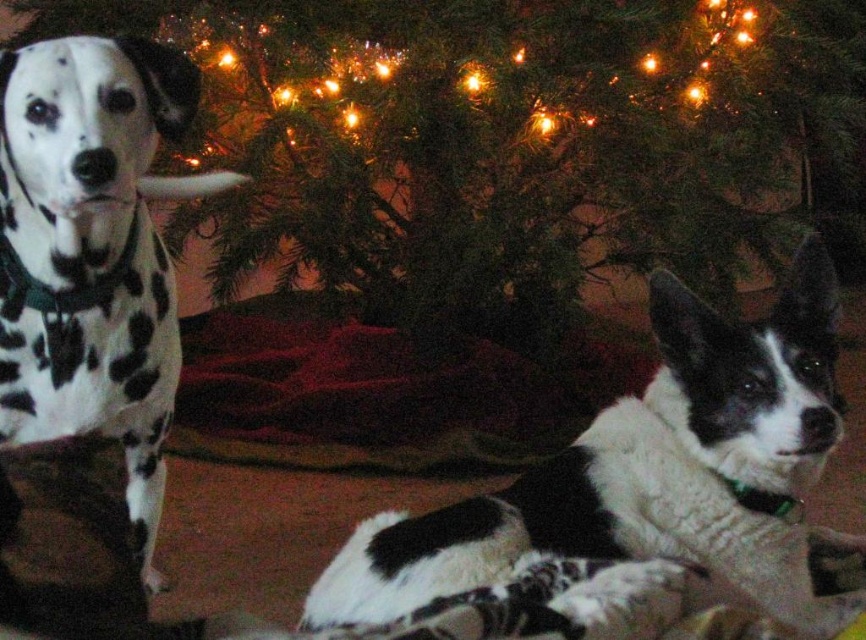
Question: Is green textured christmas tree at center to the left of black and white fur at lower right from the viewer's perspective?

Choices:
 (A) no
 (B) yes

Answer: (A)

Question: Based on their relative distances, which object is nearer to the spotted fur dog at left?

Choices:
 (A) black and white fur at lower right
 (B) green textured christmas tree at center

Answer: (A)

Question: Does green textured christmas tree at center appear on the right side of spotted fur dog at left?

Choices:
 (A) no
 (B) yes

Answer: (B)

Question: Is green textured christmas tree at center above black and white fur at lower right?

Choices:
 (A) no
 (B) yes

Answer: (B)

Question: Which object appears farthest from the camera in this image?

Choices:
 (A) spotted fur dog at left
 (B) black and white fur at lower right
 (C) green textured christmas tree at center

Answer: (C)

Question: Which object appears closest to the camera in this image?

Choices:
 (A) black and white fur at lower right
 (B) spotted fur dog at left

Answer: (B)